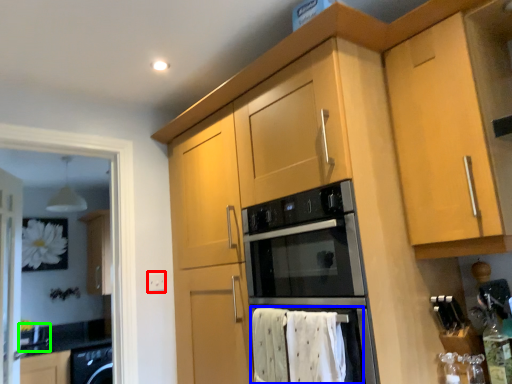
Question: Which object is positioned closest to electric outlet (highlighted by a red box)? Select from bath towel (highlighted by a blue box) and sink (highlighted by a green box).

Choices:
 (A) bath towel
 (B) sink

Answer: (A)